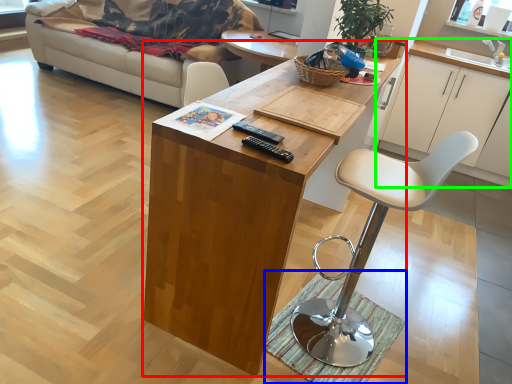
Question: Which object is the farthest from desk (highlighted by a red box)? Choose among these: mat (highlighted by a blue box) or cabinetry (highlighted by a green box).

Choices:
 (A) mat
 (B) cabinetry

Answer: (B)